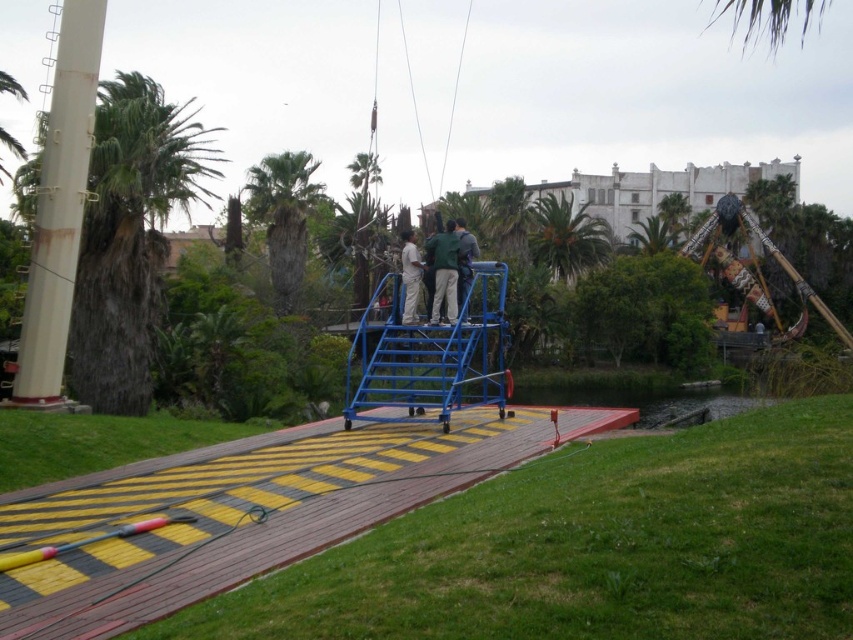
You are a photographer trying to capture both the green fabric shirt at center and the green leafy palm tree at upper right in the same frame. Which object will appear larger in the photo?

The green leafy palm tree at upper right will appear larger in the photo because it is bigger than the green fabric shirt at center.

You are a maintenance worker on the wooden platform. You need to climb up to reach the green leafy palm tree at left and the blue metallic ladder at center. Which object is shorter so you can decide which to climb first?

The green leafy palm tree at left is smaller than the blue metallic ladder at center, so you should climb the green leafy palm tree at left first since it is shorter.

You are an amusement park worker standing on the wooden platform. You need to access the blue metallic ladder at center to perform maintenance. However, there is a green leafy palm tree at left in your way. Can you reach the ladder without moving the palm tree?

The green leafy palm tree at left is above the blue metallic ladder at center, so you can reach the ladder without moving the palm tree because the ladder is below the tree and not blocking your path.